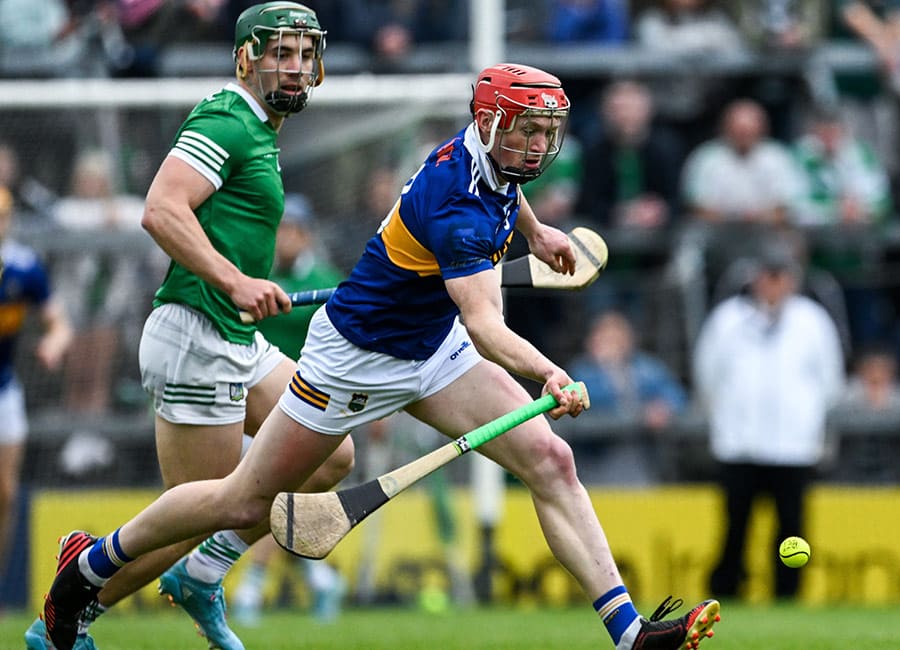
Locate an element on the screen. The width and height of the screenshot is (900, 650). stands is located at coordinates (668, 233).